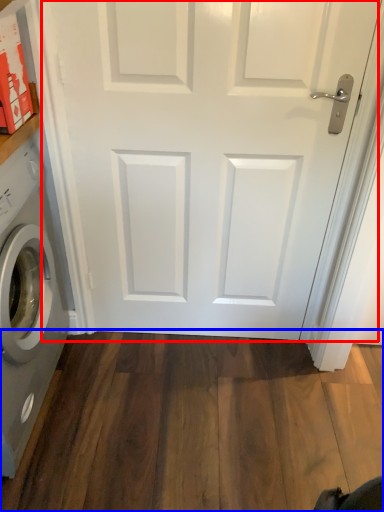
Question: Among these objects, which one is farthest to the camera, door (highlighted by a red box) or hardwood (highlighted by a blue box)?

Choices:
 (A) door
 (B) hardwood

Answer: (B)